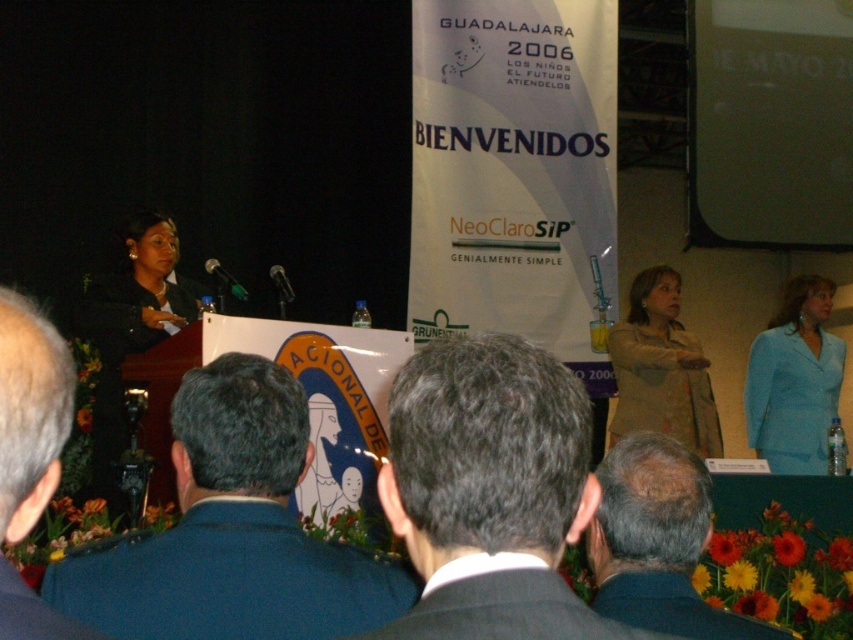
Question: Is dark gray suit at lower center smaller than light blue fabric suit at center?

Choices:
 (A) yes
 (B) no

Answer: (A)

Question: Which point is farther to the camera?

Choices:
 (A) coord(790,397)
 (B) coord(125,506)
 (C) coord(439,547)

Answer: (A)

Question: Which point is farther to the camera?

Choices:
 (A) (283, 291)
 (B) (155, 310)
 (C) (200, 508)

Answer: (A)

Question: Does dark blue suit at center lie in front of black metallic microphone at center?

Choices:
 (A) yes
 (B) no

Answer: (A)

Question: Is dark blue suit at center smaller than gray hair at left?

Choices:
 (A) yes
 (B) no

Answer: (B)

Question: Which of these objects is positioned farthest from the dark suit at center?

Choices:
 (A) black fabric at left
 (B) light blue fabric suit at center
 (C) tan fabric jacket at center
 (D) green matte microphone at center

Answer: (B)